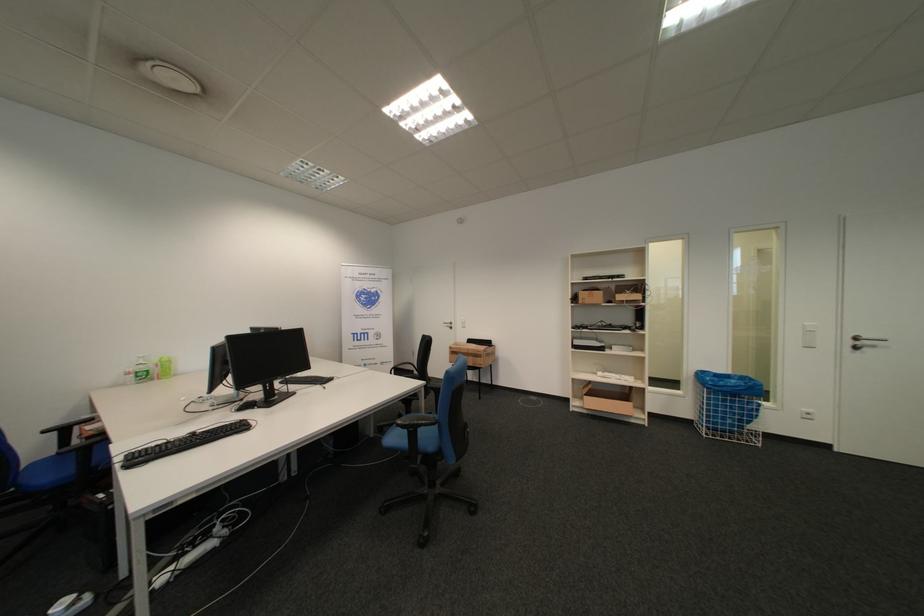
Where would you sit the black chair sitting surface? Please return your answer as a coordinate pair (x, y).

(69, 424)